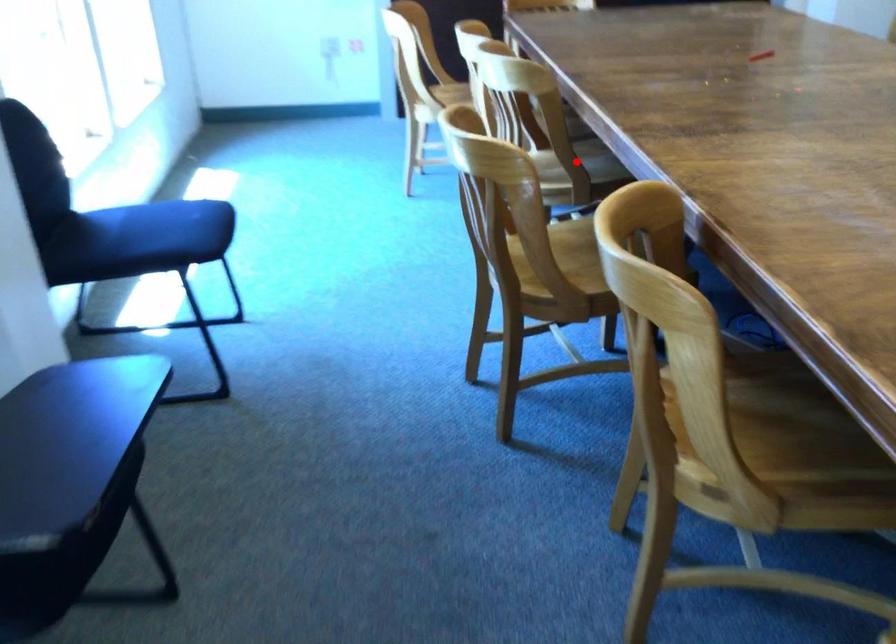
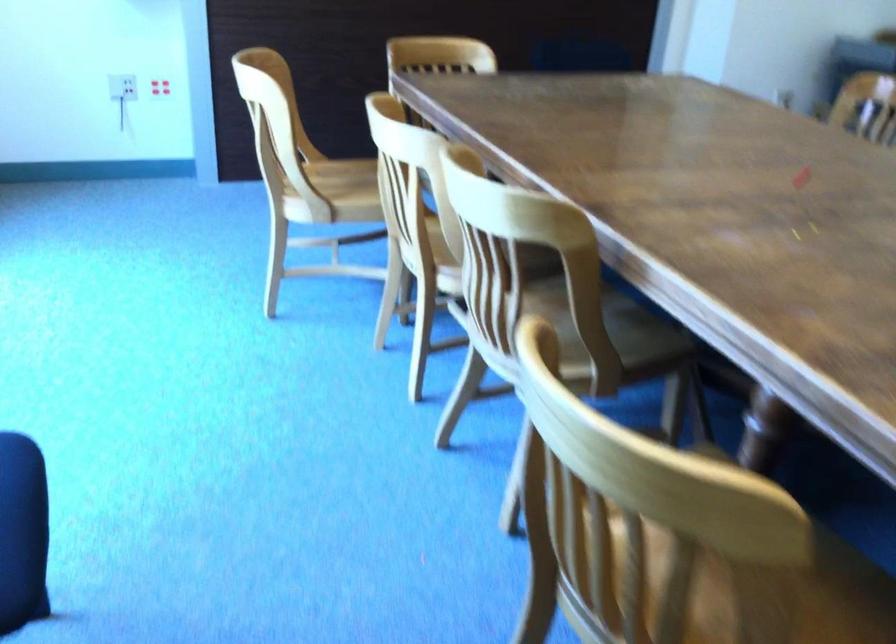
Question: I am providing you with two images of the same scene from different viewpoints. A red point is shown in image1. For the corresponding object point in image2, is it positioned nearer or farther from the camera?

Choices:
 (A) Nearer
 (B) Farther

Answer: (A)